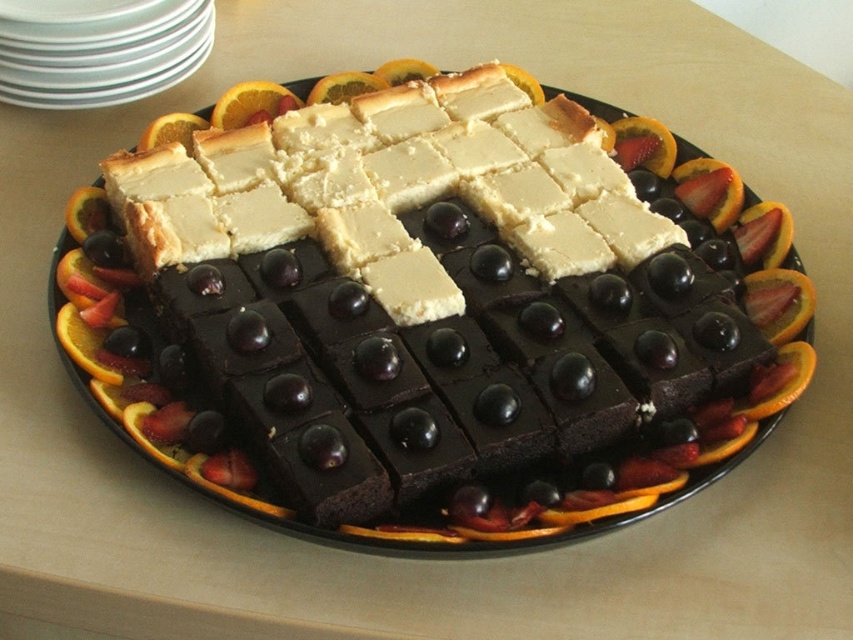
Who is positioned more to the left, smooth chocolate cake at center or orange peel at upper left?

orange peel at upper left is more to the left.

Does smooth chocolate cake at center have a greater width compared to orange peel at upper left?

Yes.

Identify the location of smooth chocolate cake at center. (410, 381).

From the picture: Does white glossy plates at upper left have a greater width compared to orangesmoothfruit at upper left?

Indeed, white glossy plates at upper left has a greater width compared to orangesmoothfruit at upper left.

Can you confirm if white glossy plates at upper left is thinner than orangesmoothfruit at upper left?

In fact, white glossy plates at upper left might be wider than orangesmoothfruit at upper left.

Does point (181, 17) lie behind point (233, 122)?

No, (181, 17) is closer to viewer.

This screenshot has height=640, width=853. Identify the location of white glossy plates at upper left. (97, 49).

Between point (57, 8) and point (454, 298), which one is positioned behind?

The point (57, 8) is more distant.

How distant is white glossy plates at upper left from white crumbly cheese at center?

The distance of white glossy plates at upper left from white crumbly cheese at center is 21.28 inches.

The image size is (853, 640). What do you see at coordinates (97, 49) in the screenshot?
I see `white glossy plates at upper left` at bounding box center [97, 49].

What are the coordinates of `white glossy plates at upper left` in the screenshot? It's located at (97, 49).